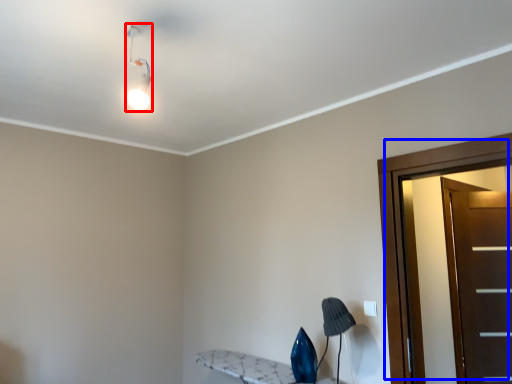
Question: Among these objects, which one is nearest to the camera, light fixture (highlighted by a red box) or door (highlighted by a blue box)?

Choices:
 (A) light fixture
 (B) door

Answer: (A)